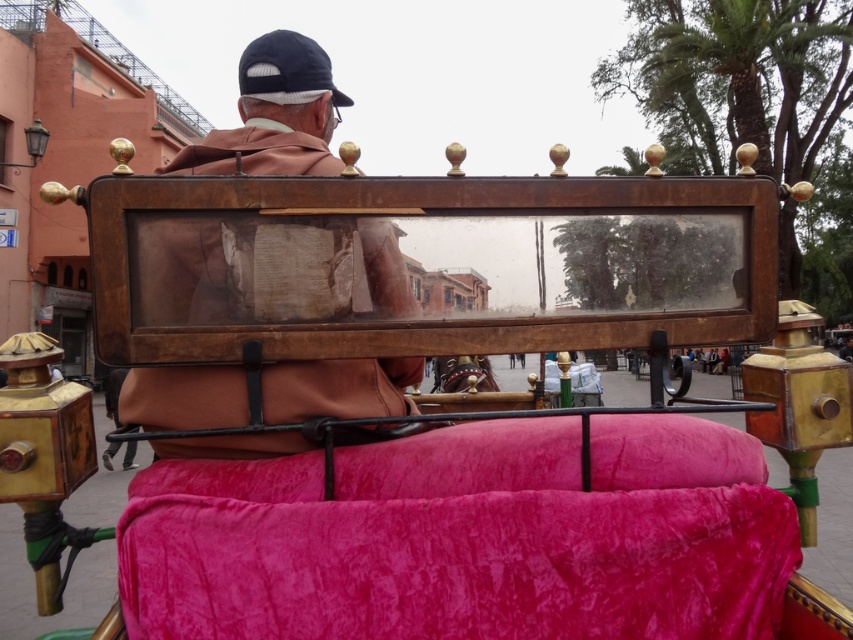
Question: Which point is closer to the camera?

Choices:
 (A) (132, 396)
 (B) (635, 442)

Answer: (B)

Question: Which point appears farthest from the camera in this image?

Choices:
 (A) (252, 605)
 (B) (358, 228)

Answer: (B)

Question: Does velvet pink blanket at center come in front of brown leather jacket at upper center?

Choices:
 (A) no
 (B) yes

Answer: (B)

Question: Is velvet pink blanket at center wider than brown leather jacket at upper center?

Choices:
 (A) no
 (B) yes

Answer: (B)

Question: Which point is farther from the camera taking this photo?

Choices:
 (A) (339, 406)
 (B) (723, 448)

Answer: (A)

Question: Is velvet pink blanket at center above brown leather jacket at upper center?

Choices:
 (A) no
 (B) yes

Answer: (A)